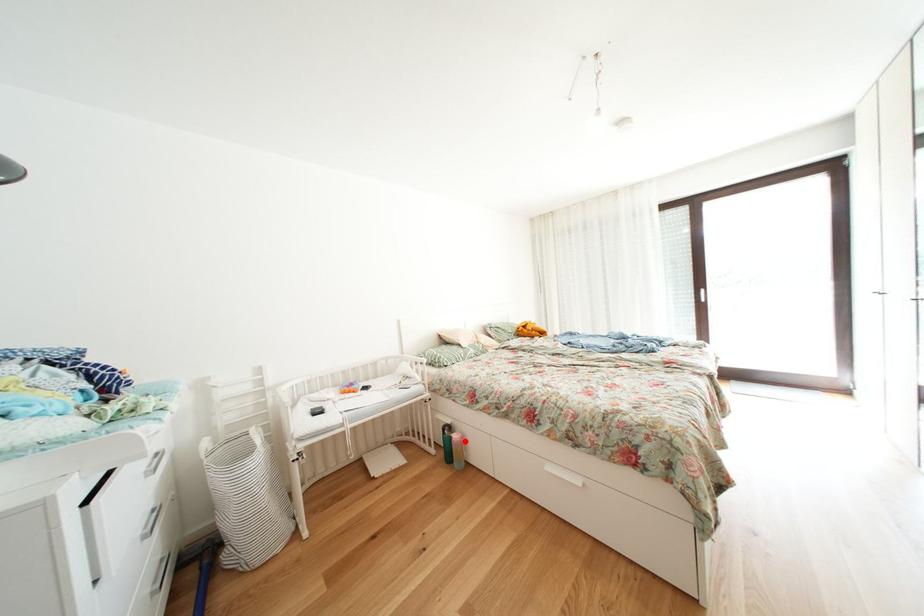
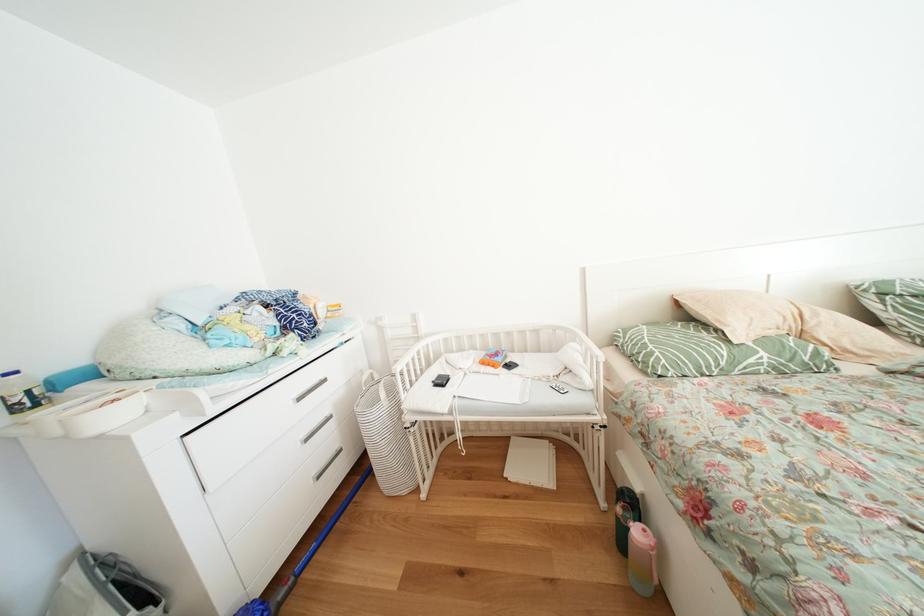
Question: I am providing you with two images of the same scene from different viewpoints. In image1, a red point is highlighted. Considering the same 3D point in image2, which of the following is correct?

Choices:
 (A) It is closer
 (B) It is farther

Answer: (A)